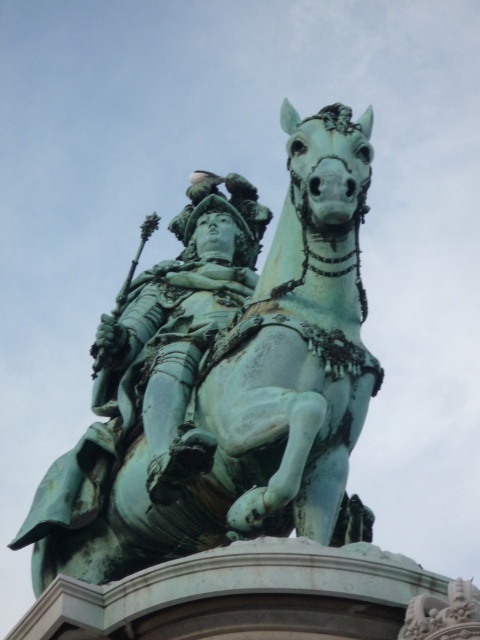
Question: Is green patinated bronze statue at center further to the viewer compared to green patinated metal statue at center?

Choices:
 (A) yes
 (B) no

Answer: (B)

Question: Which point is farther from the camera taking this photo?

Choices:
 (A) (160, 372)
 (B) (298, 467)

Answer: (A)

Question: Is green patinated bronze statue at center to the right of green patinated metal statue at center from the viewer's perspective?

Choices:
 (A) no
 (B) yes

Answer: (B)

Question: Considering the relative positions of green patinated bronze statue at center and green patinated metal statue at center in the image provided, where is green patinated bronze statue at center located with respect to green patinated metal statue at center?

Choices:
 (A) right
 (B) left

Answer: (A)

Question: Which point is farther to the camera?

Choices:
 (A) green patinated metal statue at center
 (B) green patinated bronze statue at center

Answer: (A)

Question: Which object appears closest to the camera in this image?

Choices:
 (A) green patinated bronze statue at center
 (B) green patinated metal statue at center

Answer: (A)